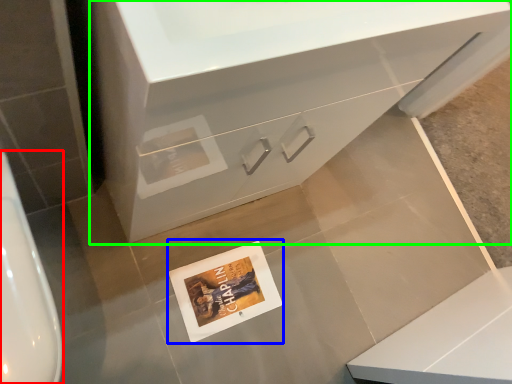
Question: Estimate the real-world distances between objects in this image. Which object is closer to urinal (highlighted by a red box), postcard (highlighted by a blue box) or bathroom cabinet (highlighted by a green box)?

Choices:
 (A) postcard
 (B) bathroom cabinet

Answer: (B)